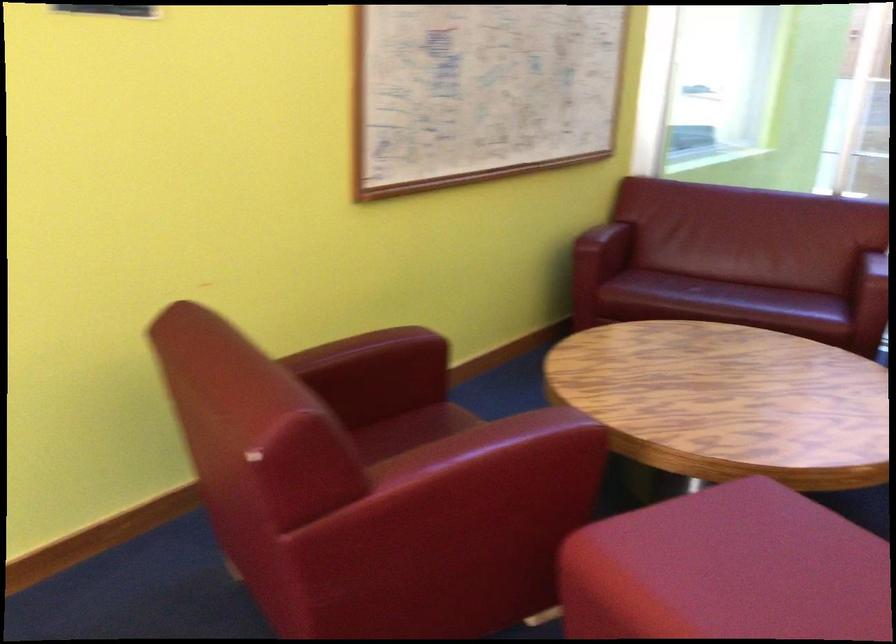
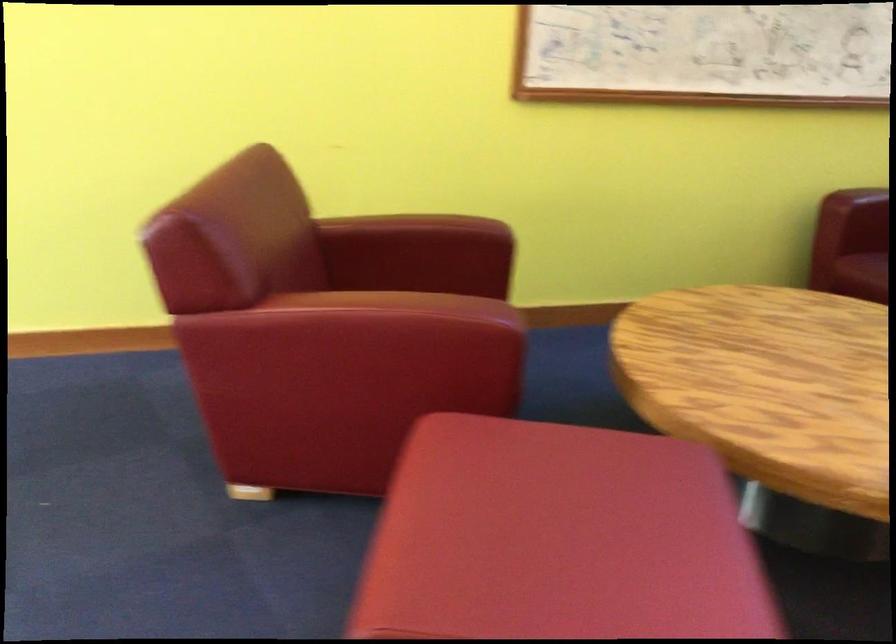
The point at (371, 377) is marked in the first image. Where is the corresponding point in the second image?

(418, 254)